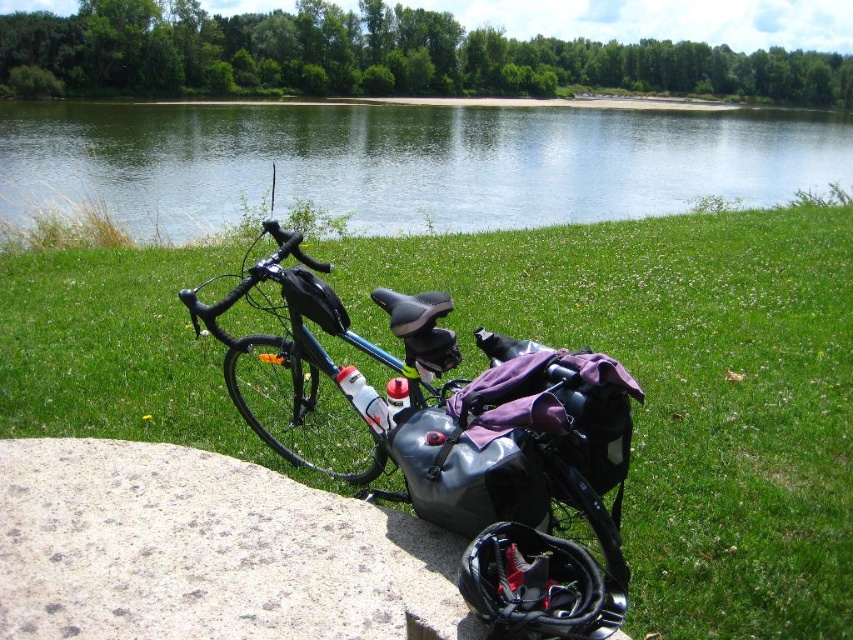
You are planning to place a small toy car on the green grass at center and the matte black bag at center. Which surface would allow the toy car to move more freely?

The green grass at center would allow the toy car to move more freely since it is wider than the matte black bag at center.

You are a drone operator who needs to land a drone on the green grass at center. According to the coordinates provided, where should you direct the drone to land?

The green grass at center is located at coordinates point [685,392], so you should direct the drone to land there.

You are standing on the grassy area near the concrete ledge where the bicycle is parked. You want to walk to the clear water at lake center. Which direction should you walk relative to the gray speckled stone at lower left?

You should walk towards the direction above the gray speckled stone at lower left to reach the clear water at lake center.